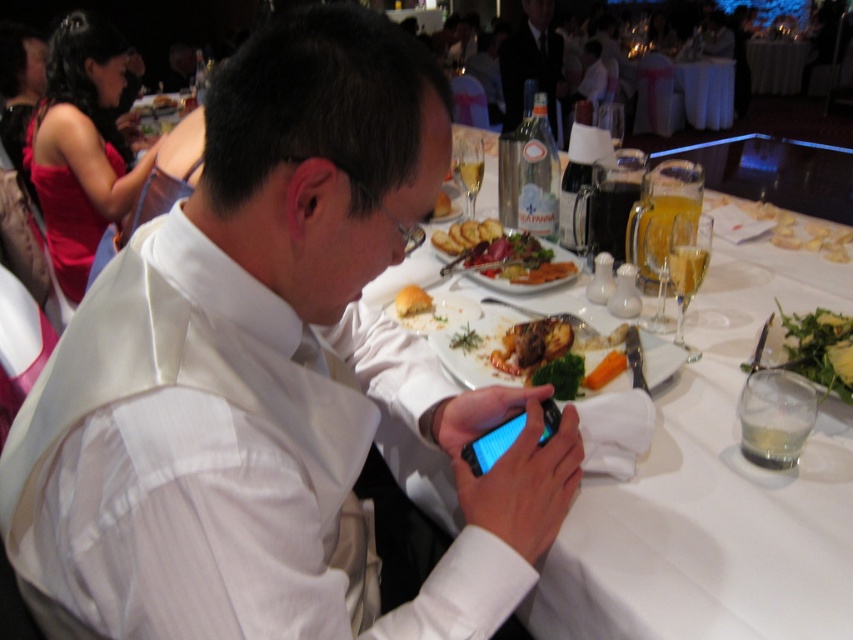
Question: Which point is closer to the camera?

Choices:
 (A) golden brown roasted meat at center
 (B) golden brown bread at center
 (C) white glossy phone at center
 (D) shiny red dress at upper left

Answer: (C)

Question: Is shiny red dress at upper left wider than matte black suit at upper center?

Choices:
 (A) no
 (B) yes

Answer: (B)

Question: Which object appears closest to the camera in this image?

Choices:
 (A) golden brown roasted meat at center
 (B) shiny red dress at upper left
 (C) golden brown meat at center

Answer: (A)

Question: Among these points, which one is nearest to the camera?

Choices:
 (A) (566, 333)
 (B) (512, 253)
 (C) (428, 376)
 (D) (630, 371)

Answer: (C)

Question: In this image, where is matte black suit at upper center located relative to black glossy smartphone at center?

Choices:
 (A) right
 (B) left

Answer: (A)

Question: Does white glossy phone at center lie behind golden brown meat at center?

Choices:
 (A) no
 (B) yes

Answer: (A)